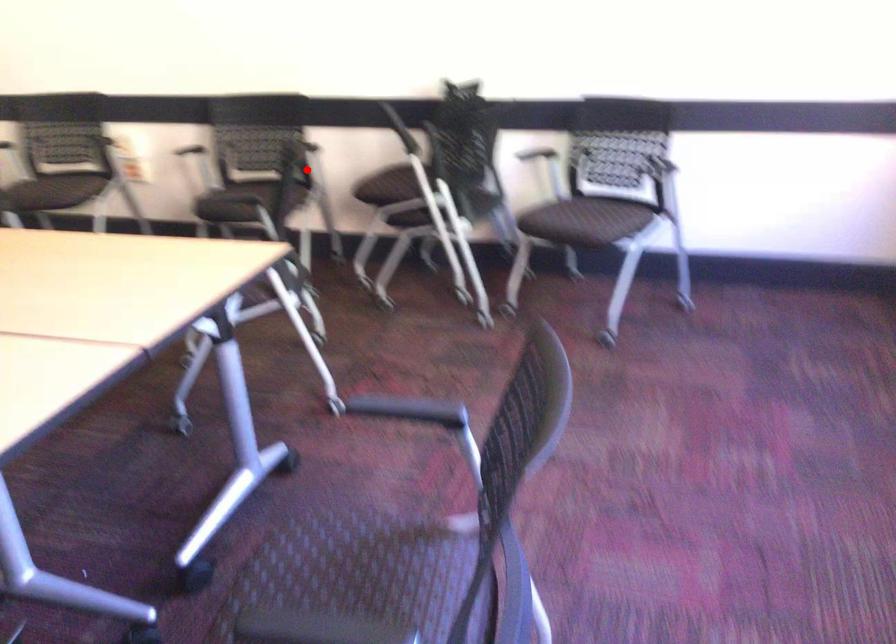
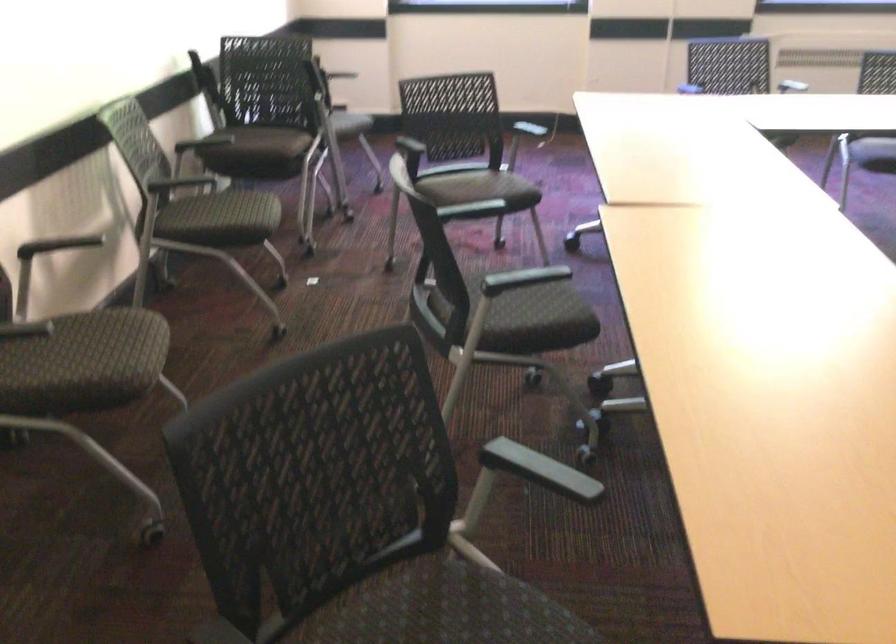
Question: I am providing you with two images of the same scene from different viewpoints. Image1 has a red point marked. In image2, the corresponding 3D location appears at what relative position? Reply with the corresponding letter.

Choices:
 (A) Closer
 (B) Farther

Answer: (A)